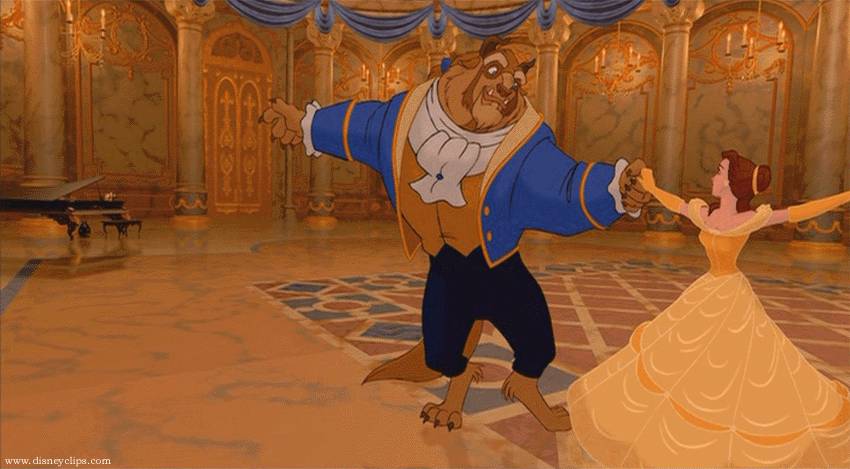
This screenshot has width=850, height=469. I want to click on grand piano, so click(x=47, y=204).